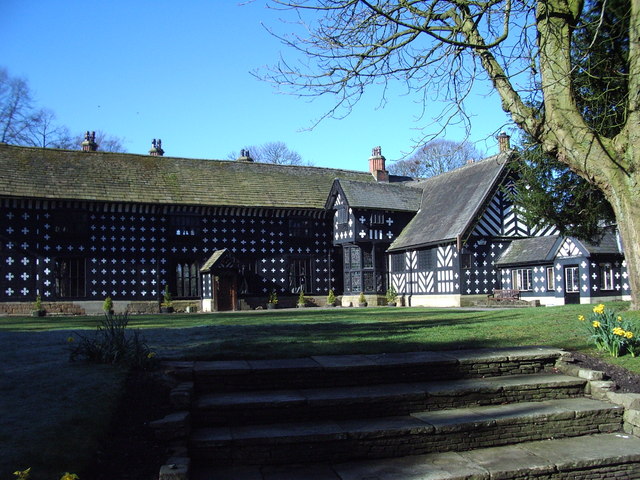
At what (x,y) coordinates should I click in order to perform the action: click on plant. Please return your answer as a coordinate pair (x, y). Looking at the image, I should click on (118, 364).